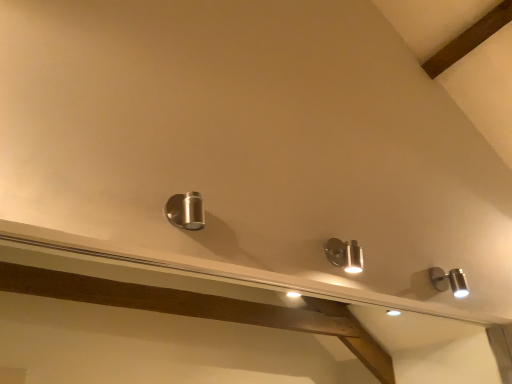
Question: Should I look upward or downward to see satin silver lamp at upper right?

Choices:
 (A) up
 (B) down

Answer: (B)